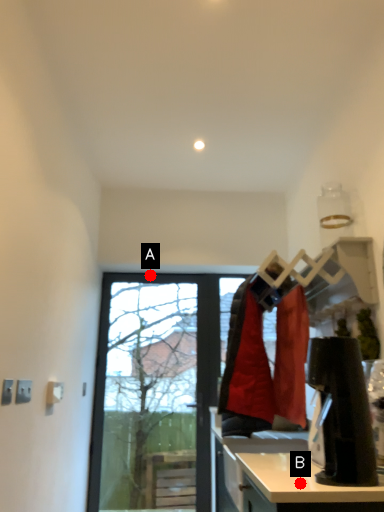
Question: Two points are circled on the image, labeled by A and B beside each circle. Among these points, which one is farthest from the camera?

Choices:
 (A) A is further
 (B) B is further

Answer: (A)